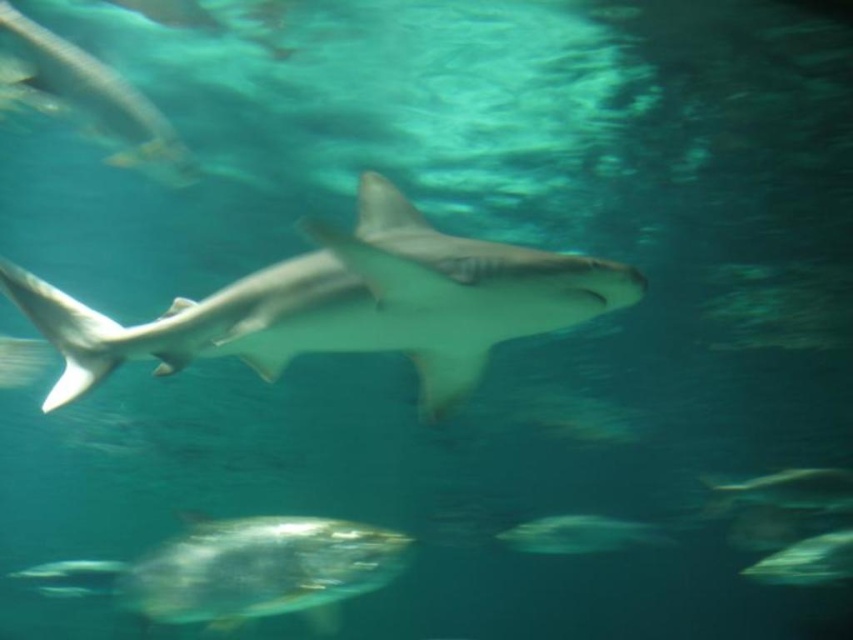
You are a marine biologist observing the underwater scene. You notice the smooth gray shark at center and the translucent gray fish at lower right. Which of these two creatures has a greater height in this image?

The smooth gray shark at center is taller than the translucent gray fish at lower right.

You are a marine biologist observing the sharks in the aquarium. You notice the smooth gray shark at center and the translucent glass fish at lower center. Which one is taller?

The smooth gray shark at center is taller than the translucent glass fish at lower center.